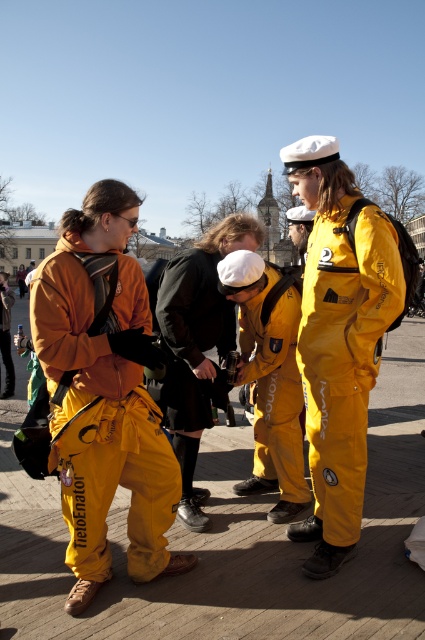
Based on the photo, you are a photographer trying to capture a group photo of the yellow waterproof suit at center and the yellow fabric jacket at left. Since you want both subjects to appear equally sized in the photo, which subject should you move closer to the camera?

To make both subjects appear equally sized in the photo, you should move the yellow waterproof suit at center closer to the camera because it is smaller than the yellow fabric jacket at left.

You are standing at the point marked as point (x=104, y=394) in the image. What color is the clothing item you are currently touching?

The point (x=104, y=394) is on matte orange jumpsuit at center, so the clothing item you are touching is matte orange.